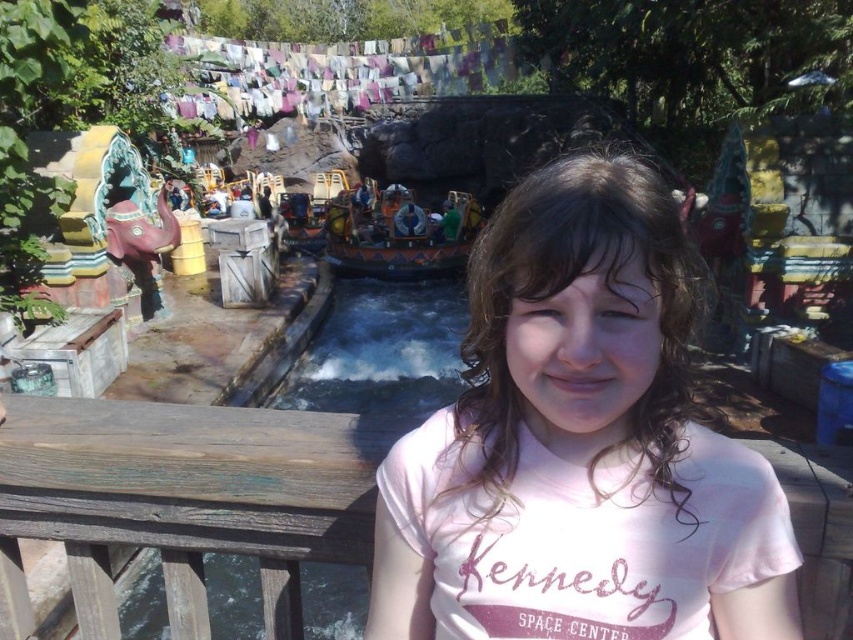
You are standing on a raised platform at the theme park and see the pink cotton shirt at center and the wooden painted boat at center. Which object is nearer to you?

The pink cotton shirt at center is closer to the viewer than the wooden painted boat at center.